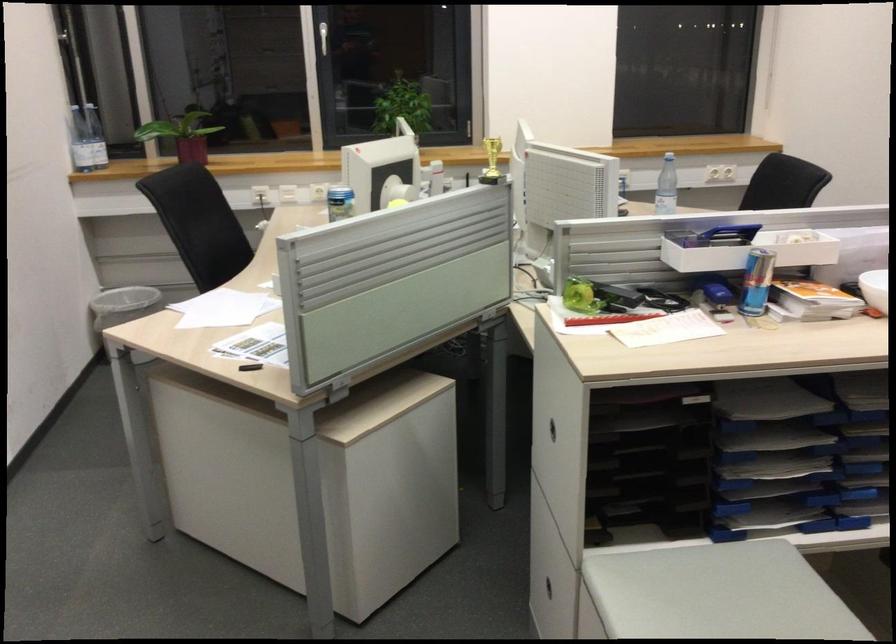
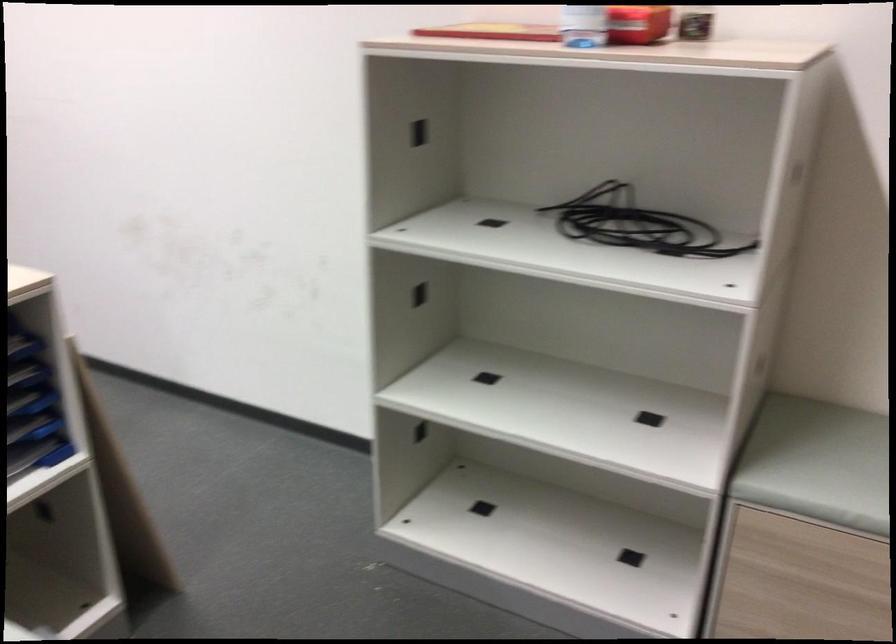
Question: Based on the continuous images, in which direction is the camera rotating? Reply with the corresponding letter.

Choices:
 (A) Left
 (B) Right
 (C) Up
 (D) Down

Answer: (B)